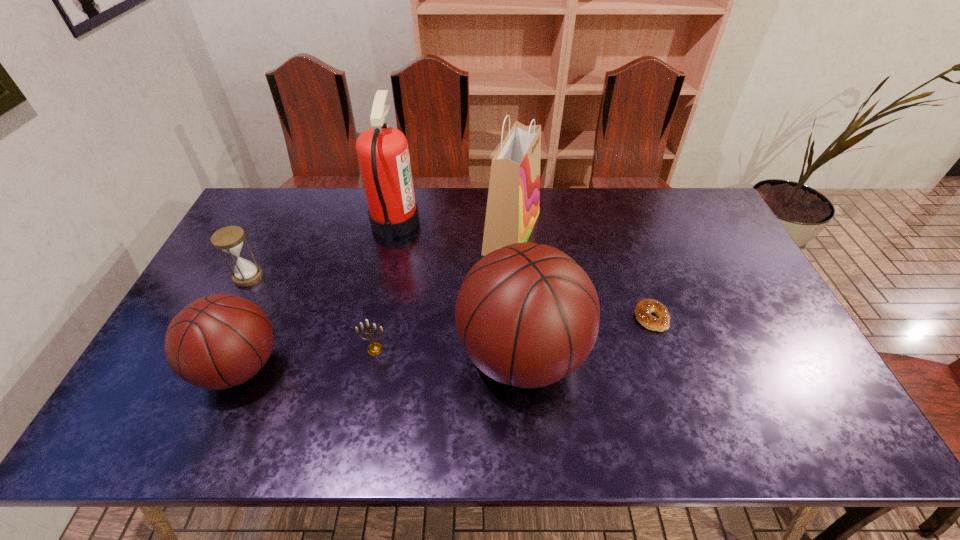
Identify the location of the left basketball. (216, 342).

The height and width of the screenshot is (540, 960). Find the location of `the shorter basketball`. the shorter basketball is located at coordinates (216, 342).

Where is `the third tallest object`? the third tallest object is located at coordinates (527, 315).

Locate an element on the screen. the taller basketball is located at coordinates tap(527, 315).

Image resolution: width=960 pixels, height=540 pixels. What are the coordinates of `fire extinguisher` in the screenshot? It's located at (383, 153).

Locate an element on the screen. shopping bag is located at coordinates (513, 203).

This screenshot has height=540, width=960. Find the location of `the third shortest object`. the third shortest object is located at coordinates (229, 239).

Locate an element on the screen. The height and width of the screenshot is (540, 960). the fifth nearest object is located at coordinates (229, 239).

Identify the location of candelabrum. (373, 349).

The image size is (960, 540). Find the location of `bagel`. bagel is located at coordinates (644, 308).